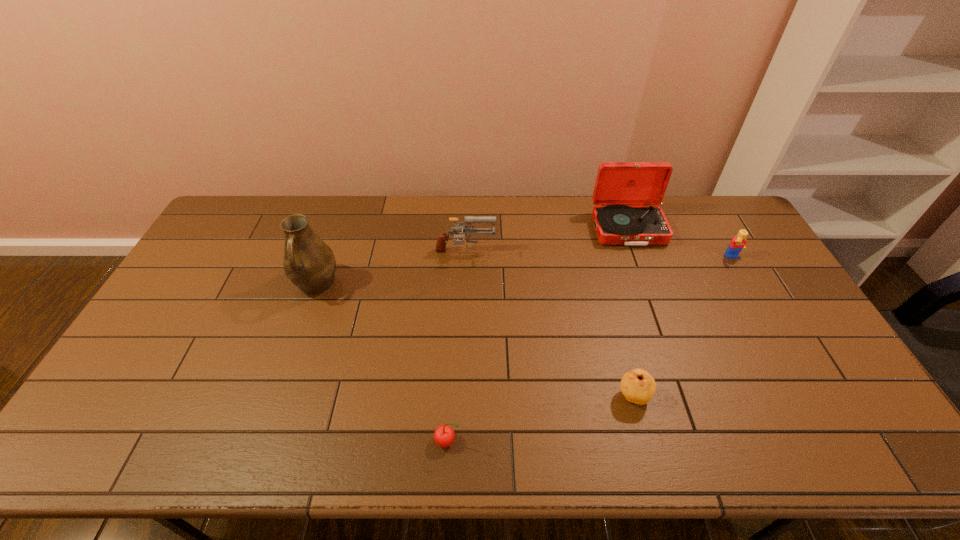
Locate an element on the screen. blank region between the fourth shortest object and the rightmost object is located at coordinates (599, 256).

The image size is (960, 540). I want to click on vacant region between the cherry and the pitcher, so click(382, 363).

Where is `free space between the rightmost object and the nearest object`? The width and height of the screenshot is (960, 540). free space between the rightmost object and the nearest object is located at coordinates (590, 349).

Identify the location of unoccupied position between the leftmost object and the second nearest object. (474, 341).

The width and height of the screenshot is (960, 540). Find the location of `free space between the pitcher and the cherry`. free space between the pitcher and the cherry is located at coordinates 382,363.

At what (x,y) coordinates should I click in order to perform the action: click on free space between the Lego and the phonograph_record. Please return your answer as a coordinate pair (x, y). Looking at the image, I should click on (681, 244).

Identify the location of vacant space in between the rightmost object and the pitcher. The width and height of the screenshot is (960, 540). (524, 272).

Point out which object is positioned as the third nearest to the Lego. Please provide its 2D coordinates. Your answer should be formatted as a tuple, i.e. [(x, y)], where the tuple contains the x and y coordinates of a point satisfying the conditions above.

[(443, 238)]

Identify the location of the closest object to the Lego. (626, 194).

Locate an element on the screen. This screenshot has height=540, width=960. vacant space that satisfies the following two spatial constraints: 1. at the barrel end of the gun; 2. on the back side of the pear is located at coordinates (461, 396).